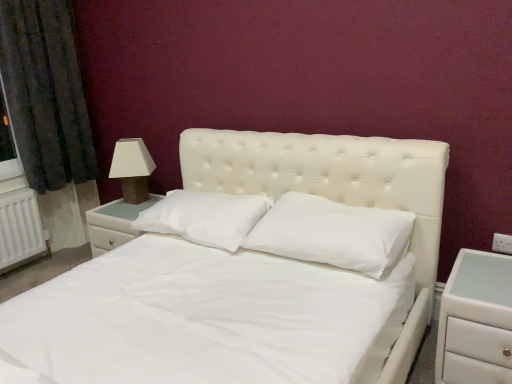
Question: From the image's perspective, is white soft pillow at center, the second pillow positioned from the right, over white matte nightstand at right, placed as the first nightstand when sorted from right to left?

Choices:
 (A) no
 (B) yes

Answer: (B)

Question: From a real-world perspective, is white soft pillow at center, the second pillow positioned from the right, positioned under white matte nightstand at right, arranged as the second nightstand when viewed from the back, based on gravity?

Choices:
 (A) yes
 (B) no

Answer: (B)

Question: Does white soft pillow at center, acting as the 1th pillow starting from the left, lie behind white matte nightstand at right, arranged as the second nightstand when viewed from the back?

Choices:
 (A) no
 (B) yes

Answer: (B)

Question: Does white soft pillow at center, acting as the 1th pillow starting from the left, turn towards white matte nightstand at right, arranged as the second nightstand when viewed from the back?

Choices:
 (A) no
 (B) yes

Answer: (A)

Question: Can you confirm if white soft pillow at center, acting as the 1th pillow starting from the left, is thinner than white matte nightstand at right, placed as the first nightstand when sorted from right to left?

Choices:
 (A) no
 (B) yes

Answer: (B)

Question: Is white soft pillow at center, the second pillow positioned from the right, facing away from white matte nightstand at right, the 2th nightstand from the left?

Choices:
 (A) no
 (B) yes

Answer: (A)

Question: Is the surface of white soft pillow at center, the 2th pillow when ordered from left to right, in direct contact with white glossy nightstand at left, the first nightstand when ordered from back to front?

Choices:
 (A) no
 (B) yes

Answer: (A)

Question: Can you confirm if white soft pillow at center, marked as the first pillow in a right-to-left arrangement, is shorter than white glossy nightstand at left, which appears as the 2th nightstand when viewed from the right?

Choices:
 (A) yes
 (B) no

Answer: (A)

Question: From a real-world perspective, is white soft pillow at center, the 2th pillow when ordered from left to right, physically below white glossy nightstand at left, placed as the first nightstand when sorted from left to right?

Choices:
 (A) yes
 (B) no

Answer: (B)

Question: Could you tell me if white soft pillow at center, marked as the first pillow in a right-to-left arrangement, is facing white glossy nightstand at left, which appears as the 2th nightstand when viewed from the right?

Choices:
 (A) yes
 (B) no

Answer: (B)

Question: From a real-world perspective, is white soft pillow at center, the 2th pillow when ordered from left to right, on white glossy nightstand at left, which appears as the 2th nightstand when viewed from the right?

Choices:
 (A) yes
 (B) no

Answer: (A)

Question: Does white soft pillow at center, the 2th pillow when ordered from left to right, have a lesser width compared to white glossy nightstand at left, which appears as the 2th nightstand when viewed from the right?

Choices:
 (A) no
 (B) yes

Answer: (B)

Question: Does white soft pillow at center, the second pillow positioned from the right, turn towards matte white lampshade at left?

Choices:
 (A) yes
 (B) no

Answer: (B)